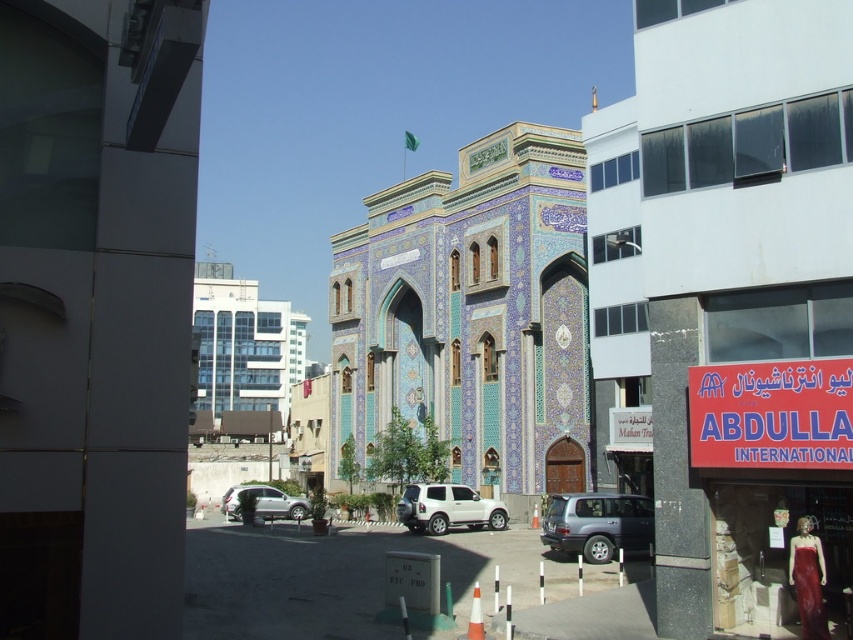
Does metallic silver suv at center appear on the left side of white matte suv at center?

No, metallic silver suv at center is not to the left of white matte suv at center.

Is point (598, 547) closer to camera compared to point (496, 525)?

Yes, point (598, 547) is closer to viewer.

Find the location of `metallic silver suv at center`. metallic silver suv at center is located at coordinates (596, 524).

This screenshot has height=640, width=853. What do you see at coordinates (447, 508) in the screenshot? I see `white matte suv at center` at bounding box center [447, 508].

Between white matte suv at center and silver metallic suv at lower center, which one has more height?

silver metallic suv at lower center is taller.

Which is behind, point (485, 518) or point (271, 499)?

The point (271, 499) is more distant.

Where is `white matte suv at center`? The image size is (853, 640). white matte suv at center is located at coordinates [447, 508].

Does metallic silver suv at center lie in front of silver metallic suv at lower center?

That is True.

Measure the distance between metallic silver suv at center and camera.

metallic silver suv at center is 40.84 meters away from camera.

At what (x,y) coordinates should I click in order to perform the action: click on metallic silver suv at center. Please return your answer as a coordinate pair (x, y). The image size is (853, 640). Looking at the image, I should click on [596, 524].